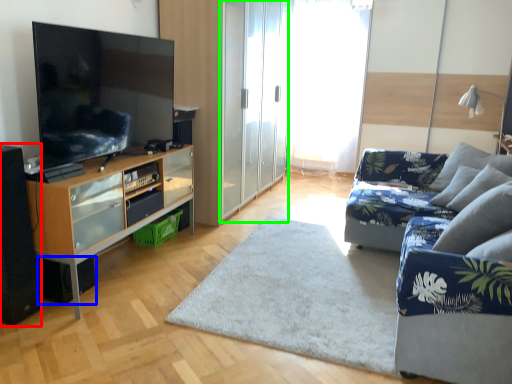
Question: Which object is positioned closest to speaker (highlighted by a red box)? Select from speaker (highlighted by a blue box) and screen door (highlighted by a green box).

Choices:
 (A) speaker
 (B) screen door

Answer: (A)